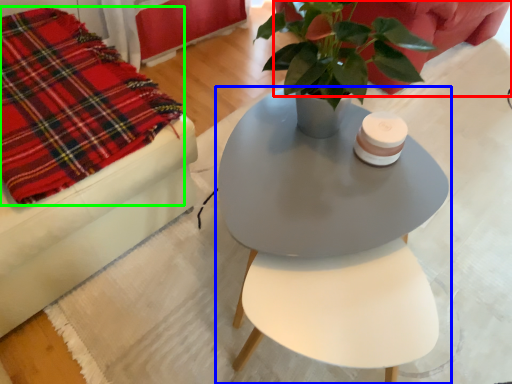
Question: Which object is the farthest from couch (highlighted by a red box)? Choose among these: table (highlighted by a blue box) or cloth (highlighted by a green box).

Choices:
 (A) table
 (B) cloth

Answer: (B)